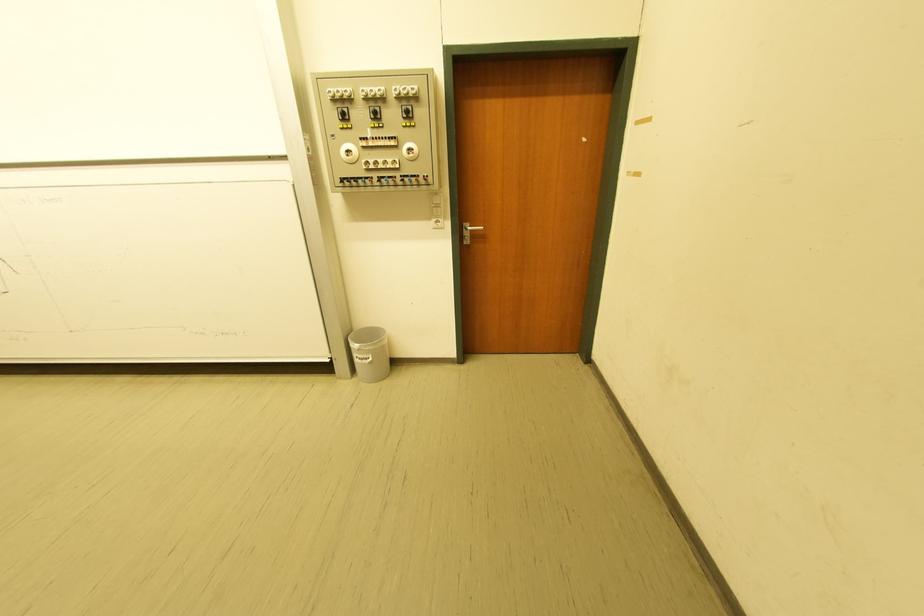
The width and height of the screenshot is (924, 616). What do you see at coordinates (381, 164) in the screenshot? I see `the white power outlet` at bounding box center [381, 164].